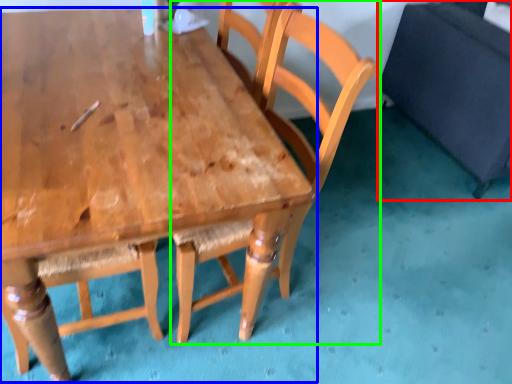
Question: Considering the real-world distances, which object is closest to swivel chair (highlighted by a red box)? table (highlighted by a blue box) or chair (highlighted by a green box).

Choices:
 (A) table
 (B) chair

Answer: (B)